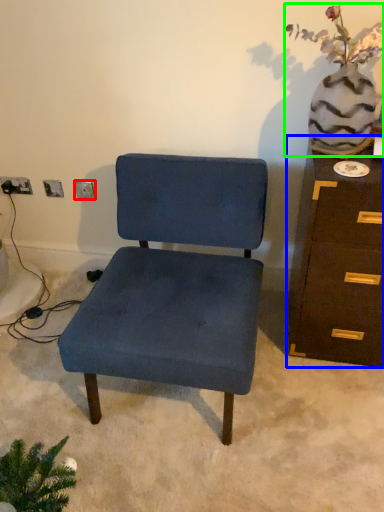
Question: Based on their relative distances, which object is nearer to electric outlet (highlighted by a red box)? Choose from chest of drawers (highlighted by a blue box) and floral arrangement (highlighted by a green box).

Choices:
 (A) chest of drawers
 (B) floral arrangement

Answer: (B)